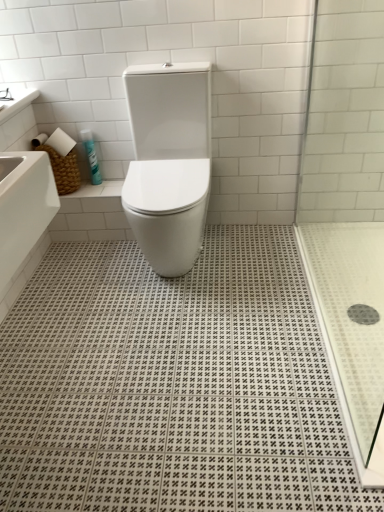
Question: Does white glossy countertop at upper left appear on the left side of blue glossy spray can at upper left?

Choices:
 (A) yes
 (B) no

Answer: (A)

Question: From a real-world perspective, is white glossy countertop at upper left over blue glossy spray can at upper left?

Choices:
 (A) yes
 (B) no

Answer: (A)

Question: Does white glossy countertop at upper left lie in front of blue glossy spray can at upper left?

Choices:
 (A) no
 (B) yes

Answer: (B)

Question: Is white glossy countertop at upper left directly adjacent to blue glossy spray can at upper left?

Choices:
 (A) no
 (B) yes

Answer: (A)

Question: Is blue glossy spray can at upper left completely or partially inside white glossy countertop at upper left?

Choices:
 (A) yes
 (B) no

Answer: (B)

Question: Considering the positions of blue glossy spray can at upper left and transparent glass shower door at right in the image, is blue glossy spray can at upper left bigger or smaller than transparent glass shower door at right?

Choices:
 (A) big
 (B) small

Answer: (B)

Question: Would you say blue glossy spray can at upper left is to the left or to the right of transparent glass shower door at right in the picture?

Choices:
 (A) right
 (B) left

Answer: (B)

Question: From their relative heights in the image, would you say blue glossy spray can at upper left is taller or shorter than transparent glass shower door at right?

Choices:
 (A) short
 (B) tall

Answer: (A)

Question: Considering their positions, is blue glossy spray can at upper left located in front of or behind transparent glass shower door at right?

Choices:
 (A) front
 (B) behind

Answer: (B)

Question: Considering their positions, is blue glossy spray can at upper left located in front of or behind black rubber drain at lower right?

Choices:
 (A) front
 (B) behind

Answer: (B)

Question: From a real-world perspective, is blue glossy spray can at upper left above or below black rubber drain at lower right?

Choices:
 (A) above
 (B) below

Answer: (A)

Question: Is blue glossy spray can at upper left to the left or to the right of black rubber drain at lower right in the image?

Choices:
 (A) left
 (B) right

Answer: (A)

Question: In terms of width, does blue glossy spray can at upper left look wider or thinner when compared to black rubber drain at lower right?

Choices:
 (A) thin
 (B) wide

Answer: (A)

Question: Considering the positions of point (172, 67) and point (344, 156), is point (172, 67) closer or farther from the camera than point (344, 156)?

Choices:
 (A) farther
 (B) closer

Answer: (B)

Question: From a real-world perspective, is white glossy toilet at center above or below transparent glass shower door at right?

Choices:
 (A) above
 (B) below

Answer: (B)